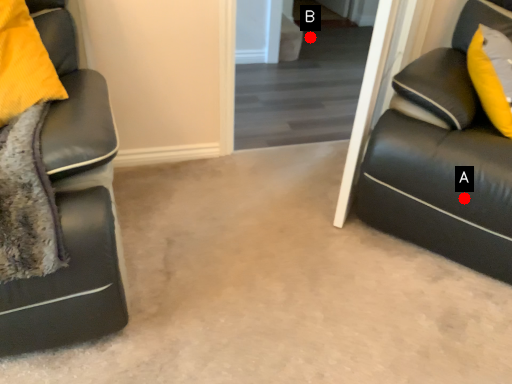
Question: Two points are circled on the image, labeled by A and B beside each circle. Among these points, which one is farthest from the camera?

Choices:
 (A) A is further
 (B) B is further

Answer: (B)